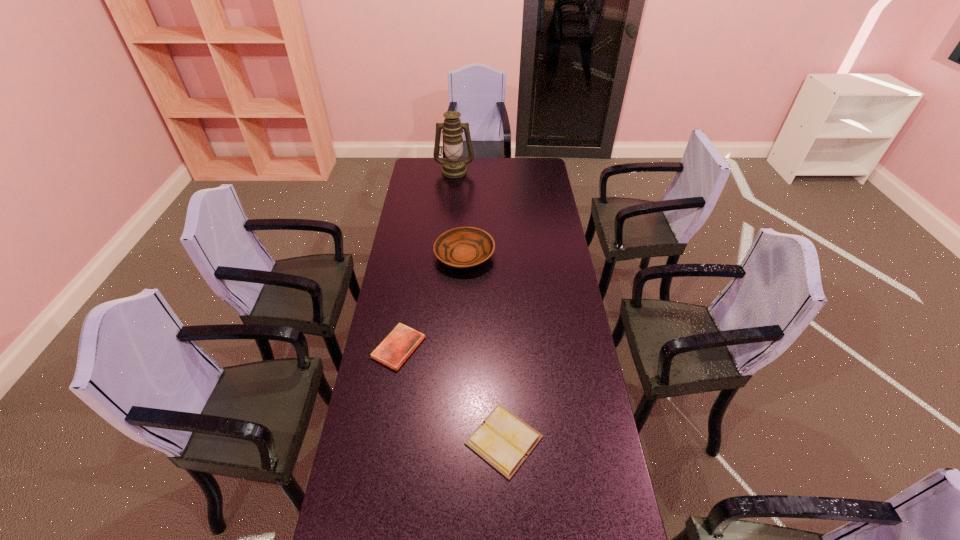
Identify the location of free spot between the second tallest object and the right diary. (484, 348).

Where is `vacant area between the shortest object and the plate`? vacant area between the shortest object and the plate is located at coordinates (432, 302).

I want to click on free area in between the farther diary and the third tallest object, so click(451, 394).

Identify the location of free space between the tallest object and the shortest object. (426, 259).

I want to click on vacant space that is in between the tallest object and the taller diary, so click(x=479, y=305).

Where is `empty space that is in between the third shortest object and the farther diary`? The height and width of the screenshot is (540, 960). empty space that is in between the third shortest object and the farther diary is located at coordinates (432, 302).

Where is `vacant area between the third shortest object and the second shortest object`? The height and width of the screenshot is (540, 960). vacant area between the third shortest object and the second shortest object is located at coordinates (484, 348).

The image size is (960, 540). What are the coordinates of `vacant space in between the oil lamp and the third nearest object` in the screenshot? It's located at (460, 213).

Find the location of `vacant space in between the shortest object and the taller diary`. vacant space in between the shortest object and the taller diary is located at coordinates (451, 394).

Image resolution: width=960 pixels, height=540 pixels. What are the coordinates of `vacant area between the farthest object and the left diary` in the screenshot? It's located at (426, 259).